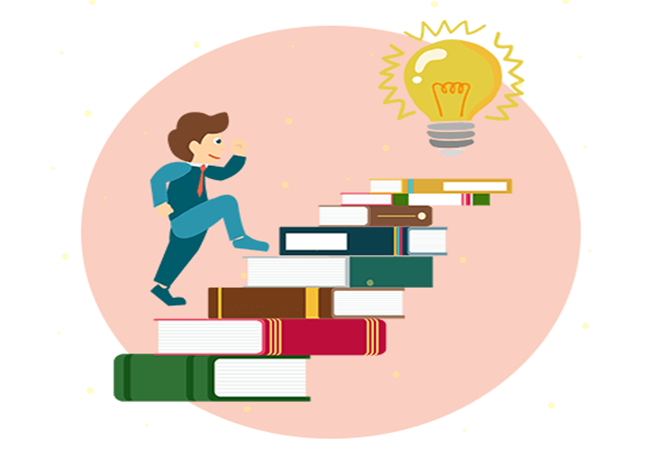
Locate an element on the screen. The height and width of the screenshot is (450, 650). book is located at coordinates (162, 388), (211, 344), (266, 301), (296, 268), (313, 243), (350, 217), (377, 198), (409, 184).